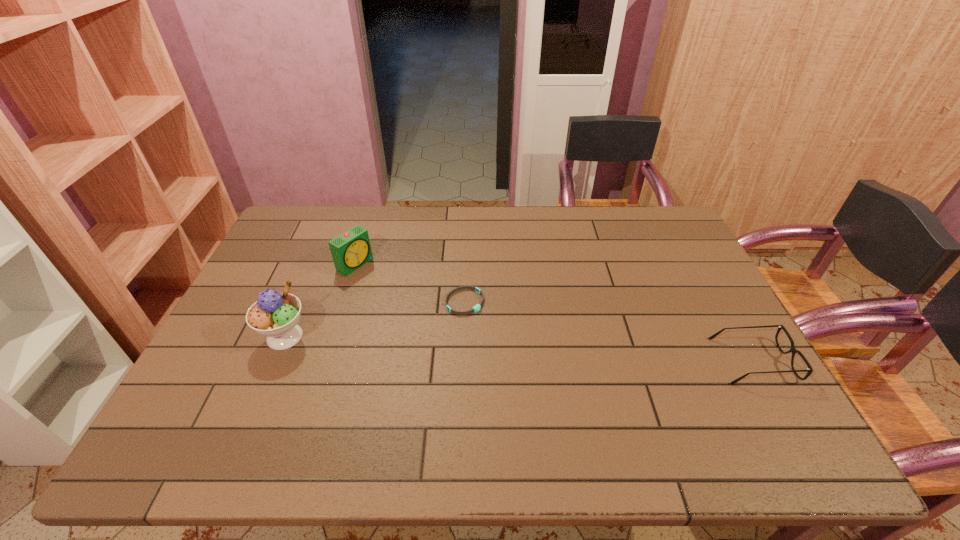
Find the location of `free space that satisfies the following two spatial constraints: 1. on the front side of the alarm clock; 2. on the left side of the third object from left to right`. free space that satisfies the following two spatial constraints: 1. on the front side of the alarm clock; 2. on the left side of the third object from left to right is located at coordinates click(343, 302).

The image size is (960, 540). What are the coordinates of `free space that satisfies the following two spatial constraints: 1. on the front side of the third shortest object; 2. with the lenses facing outward on the spectacles` in the screenshot? It's located at (324, 361).

Find the location of a particular element. The width and height of the screenshot is (960, 540). free location that satisfies the following two spatial constraints: 1. on the front side of the rightmost object; 2. with the lenses facing outward on the icecream is located at coordinates (275, 361).

Where is `free space in the image that satisfies the following two spatial constraints: 1. on the front side of the leftmost object; 2. with the lenses facing outward on the third tallest object`? This screenshot has width=960, height=540. free space in the image that satisfies the following two spatial constraints: 1. on the front side of the leftmost object; 2. with the lenses facing outward on the third tallest object is located at coordinates (275, 361).

At what (x,y) coordinates should I click in order to perform the action: click on free location that satisfies the following two spatial constraints: 1. on the front side of the second object from left to right; 2. on the right side of the second object from right to left. Please return your answer as a coordinate pair (x, y). This screenshot has width=960, height=540. Looking at the image, I should click on (343, 302).